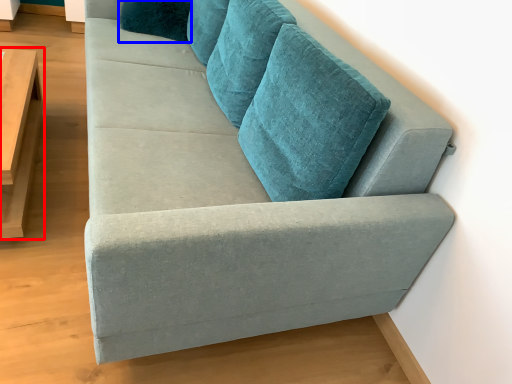
Question: Which point is closer to the camera, table (highlighted by a red box) or pillow (highlighted by a blue box)?

Choices:
 (A) table
 (B) pillow

Answer: (A)